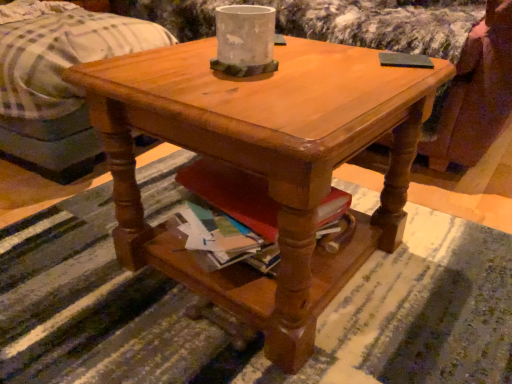
Question: Does matte wood coffee table at center turn towards white concrete vase at center?

Choices:
 (A) no
 (B) yes

Answer: (A)

Question: Is matte wood coffee table at center thinner than white concrete vase at center?

Choices:
 (A) no
 (B) yes

Answer: (A)

Question: From a real-world perspective, is matte wood coffee table at center located beneath white concrete vase at center?

Choices:
 (A) no
 (B) yes

Answer: (B)

Question: Is matte wood coffee table at center shorter than white concrete vase at center?

Choices:
 (A) no
 (B) yes

Answer: (A)

Question: Is matte wood coffee table at center not close to white concrete vase at center?

Choices:
 (A) yes
 (B) no

Answer: (B)

Question: Is white cotton bed at upper left wider or thinner than white concrete vase at center?

Choices:
 (A) wide
 (B) thin

Answer: (A)

Question: From the image's perspective, relative to white concrete vase at center, is white cotton bed at upper left above or below?

Choices:
 (A) above
 (B) below

Answer: (A)

Question: From a real-world perspective, is white cotton bed at upper left positioned above or below white concrete vase at center?

Choices:
 (A) below
 (B) above

Answer: (A)

Question: Would you say white cotton bed at upper left is to the left or to the right of white concrete vase at center in the picture?

Choices:
 (A) right
 (B) left

Answer: (B)

Question: Looking at their shapes, would you say white concrete vase at center is wider or thinner than white cotton bed at upper left?

Choices:
 (A) thin
 (B) wide

Answer: (A)

Question: Considering the positions of white concrete vase at center and white cotton bed at upper left in the image, is white concrete vase at center taller or shorter than white cotton bed at upper left?

Choices:
 (A) tall
 (B) short

Answer: (B)

Question: Considering the positions of point 245,56 and point 75,59, is point 245,56 closer or farther from the camera than point 75,59?

Choices:
 (A) closer
 (B) farther

Answer: (A)

Question: Which is correct: white concrete vase at center is inside white cotton bed at upper left, or outside of it?

Choices:
 (A) outside
 (B) inside

Answer: (A)

Question: From the image's perspective, is white concrete vase at center located above or below matte wood coffee table at center?

Choices:
 (A) above
 (B) below

Answer: (A)

Question: Does point (220, 54) appear closer or farther from the camera than point (96, 74)?

Choices:
 (A) closer
 (B) farther

Answer: (B)